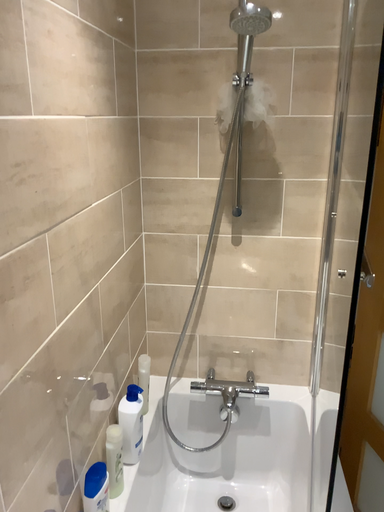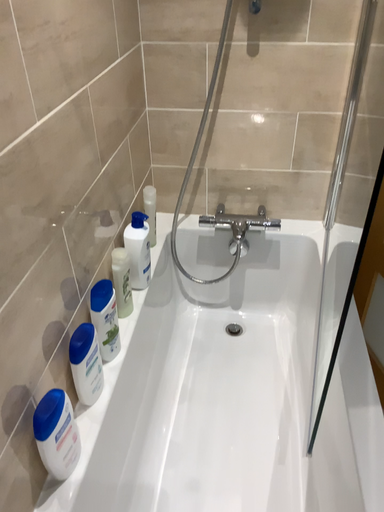
Question: Which way did the camera rotate in the video?

Choices:
 (A) rotated upward
 (B) rotated downward

Answer: (B)